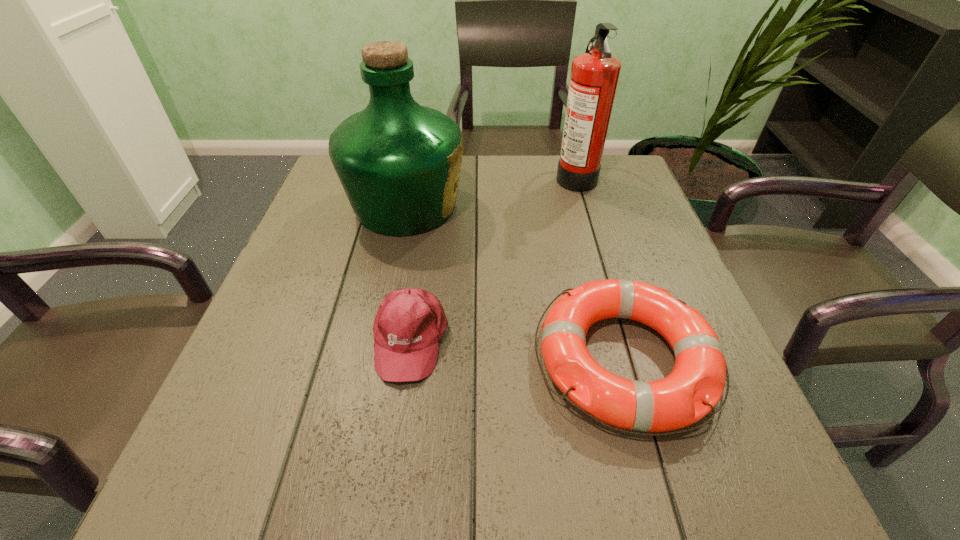
Image resolution: width=960 pixels, height=540 pixels. Find the location of `vacant space at the near left corner of the desktop`. vacant space at the near left corner of the desktop is located at coordinates (194, 478).

Locate an element on the screen. The width and height of the screenshot is (960, 540). free spot at the near right corner of the desktop is located at coordinates (732, 469).

Locate an element on the screen. The image size is (960, 540). free space between the fire extinguisher and the liquor is located at coordinates (491, 191).

At what (x,y) coordinates should I click in order to perform the action: click on empty space that is in between the shortest object and the baseball cap. Please return your answer as a coordinate pair (x, y). This screenshot has height=540, width=960. Looking at the image, I should click on (518, 349).

This screenshot has height=540, width=960. Find the location of `free space between the baseball cap and the life buoy`. free space between the baseball cap and the life buoy is located at coordinates (518, 349).

Where is `free space between the life buoy and the baseball cap`? This screenshot has width=960, height=540. free space between the life buoy and the baseball cap is located at coordinates (518, 349).

The height and width of the screenshot is (540, 960). In order to click on empty location between the baseball cap and the liquor in this screenshot , I will do `click(408, 273)`.

Identify the location of vacant space that is in between the baseball cap and the liquor. Image resolution: width=960 pixels, height=540 pixels. (408, 273).

Locate an element on the screen. The image size is (960, 540). unoccupied area between the liquor and the baseball cap is located at coordinates (408, 273).

I want to click on unoccupied area between the baseball cap and the liquor, so click(408, 273).